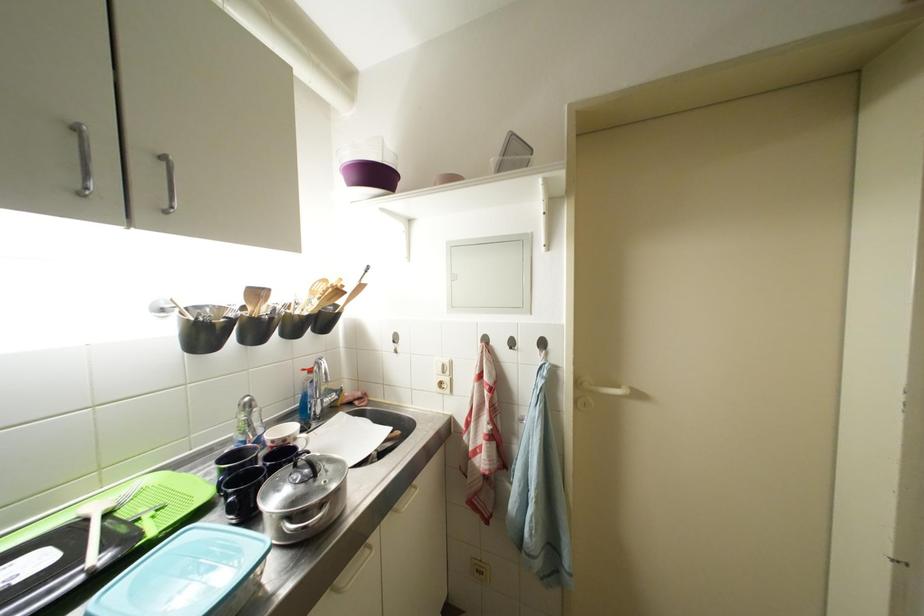
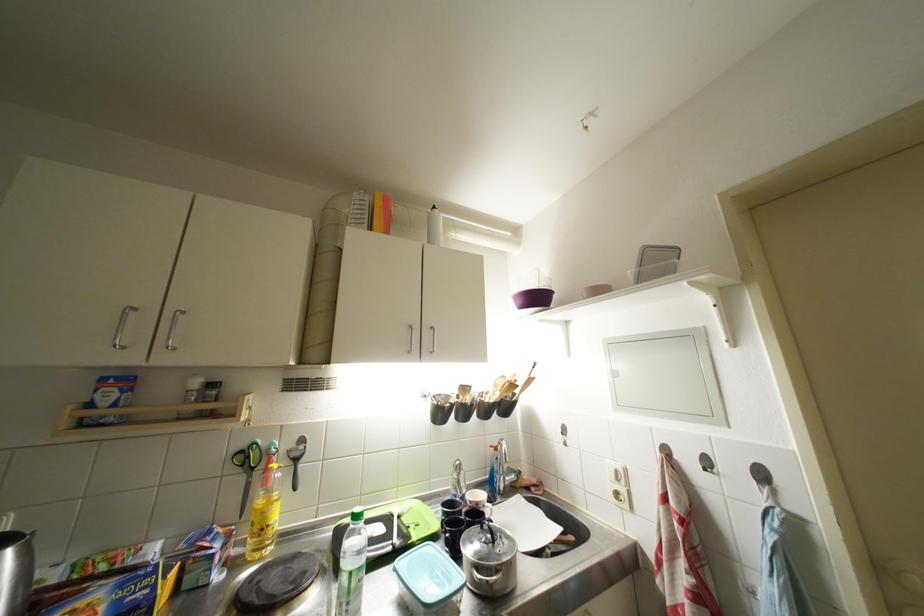
Find the pixel in the second image that matches pixel 228 474 in the first image.

(451, 516)